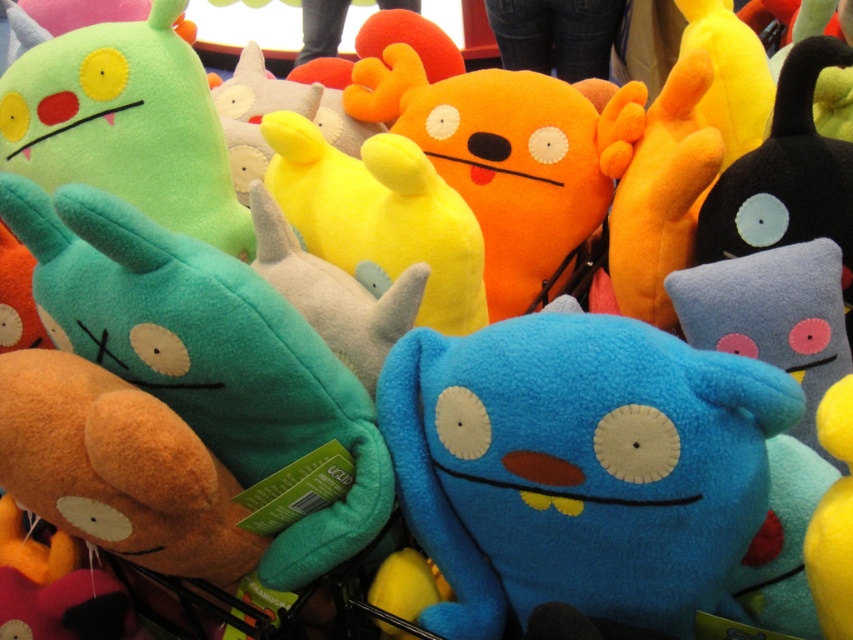
Question: Does teal plush toy at center-left appear over orange plush toy at center?

Choices:
 (A) yes
 (B) no

Answer: (B)

Question: Estimate the real-world distances between objects in this image. Which object is farther from the blue plush toy at center?

Choices:
 (A) orange plush toy at center
 (B) teal plush toy at center-left

Answer: (A)

Question: Which point is closer to the camera taking this photo?

Choices:
 (A) (187, 356)
 (B) (608, 596)

Answer: (A)

Question: Does blue plush toy at center lie behind teal plush toy at center-left?

Choices:
 (A) no
 (B) yes

Answer: (A)

Question: Which object is closer to the camera taking this photo?

Choices:
 (A) blue plush toy at center
 (B) teal plush toy at center-left
 (C) orange plush toy at center

Answer: (A)

Question: Is blue plush toy at center further to camera compared to orange plush toy at center?

Choices:
 (A) no
 (B) yes

Answer: (A)